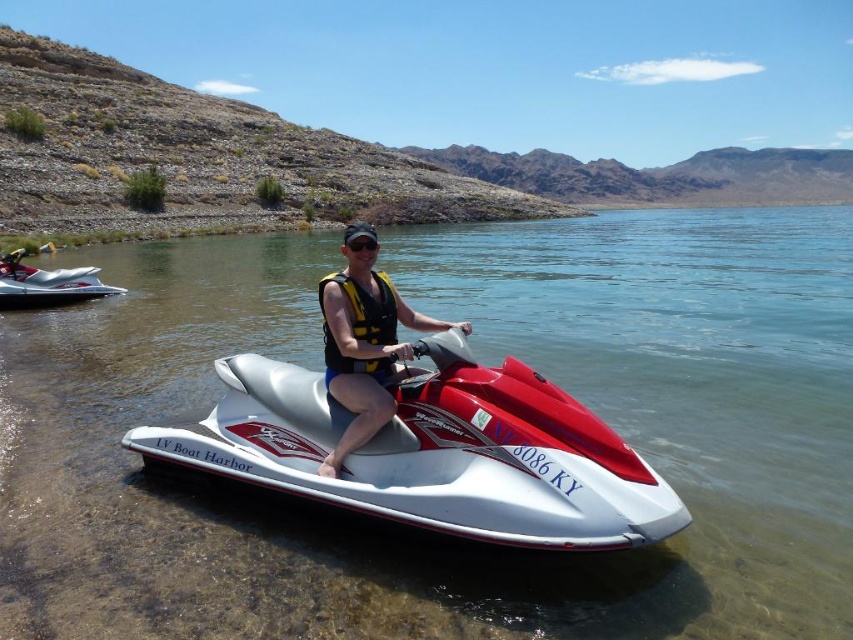
Who is lower down, white glossy water at center or yellow/textured life jacket at center?

yellow/textured life jacket at center is below.

Which of these two, white glossy water at center or yellow/textured life jacket at center, stands shorter?

With less height is yellow/textured life jacket at center.

Does point (19, 611) come farther from viewer compared to point (352, 291)?

No.

Locate an element on the screen. white glossy water at center is located at coordinates (483, 362).

Does point (721, 460) come in front of point (566, 540)?

That is False.

Is point (308, 358) closer to viewer compared to point (247, 388)?

That is False.

Identify the location of white glossy water at center. The image size is (853, 640). (483, 362).

Who is shorter, yellow/textured life jacket at center or white glossy jet ski at left?

With less height is white glossy jet ski at left.

Does yellow/textured life jacket at center have a larger size compared to white glossy jet ski at left?

Yes.

Between point (329, 333) and point (28, 288), which one is positioned in front?

Point (329, 333)

The height and width of the screenshot is (640, 853). What are the coordinates of `yellow/textured life jacket at center` in the screenshot? It's located at (361, 323).